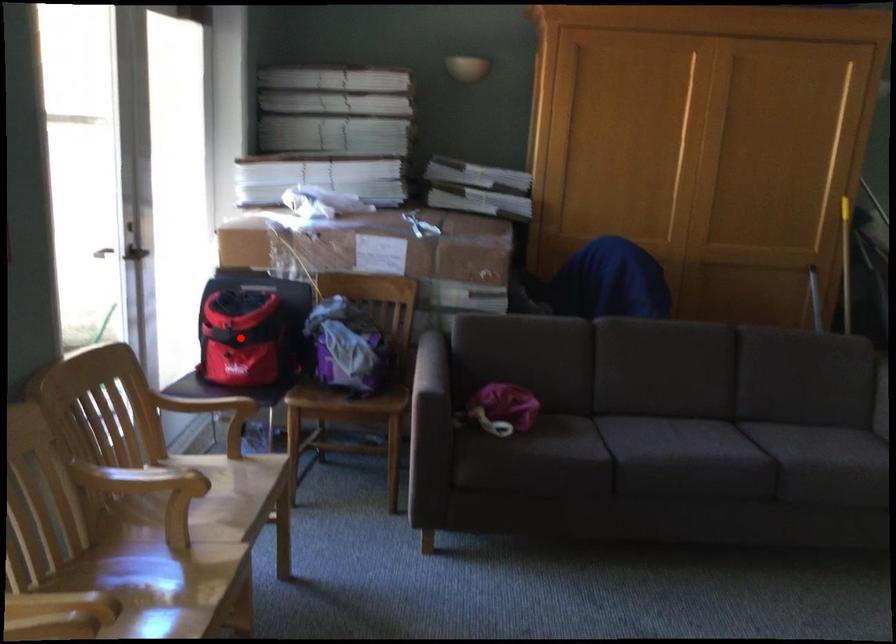
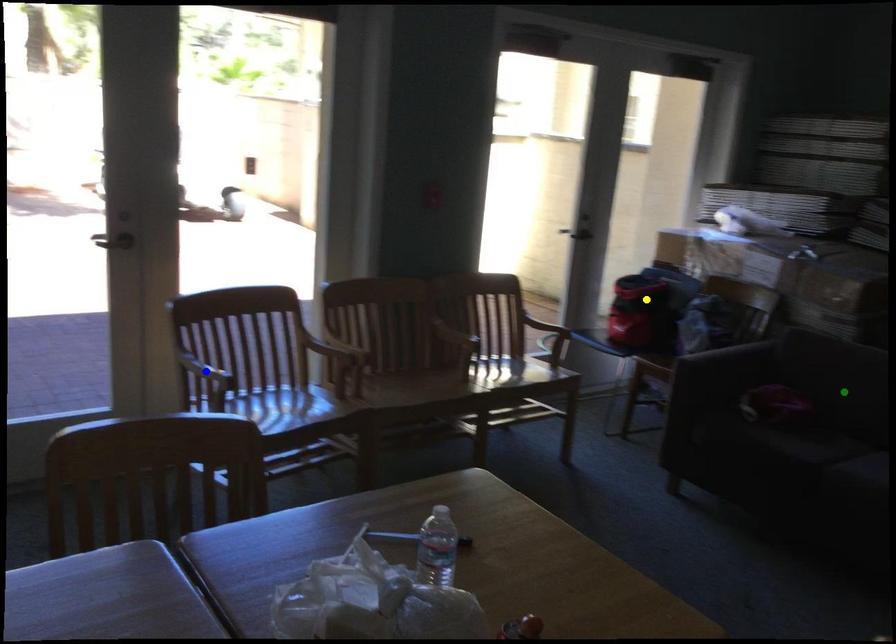
Question: I am providing you with two images of the same scene from different viewpoints. A red point is marked on the first image. You are given multiple points on the second image. In image 2, which mark is for the same physical point as the one in image 1?

Choices:
 (A) yellow point
 (B) green point
 (C) blue point

Answer: (A)